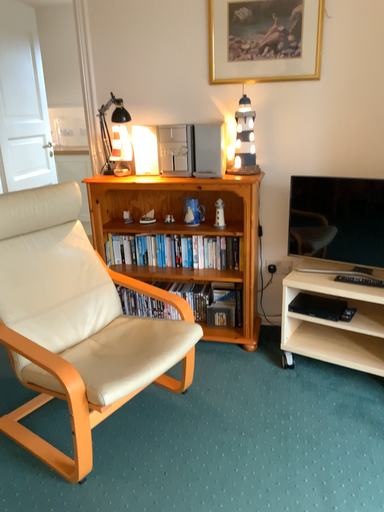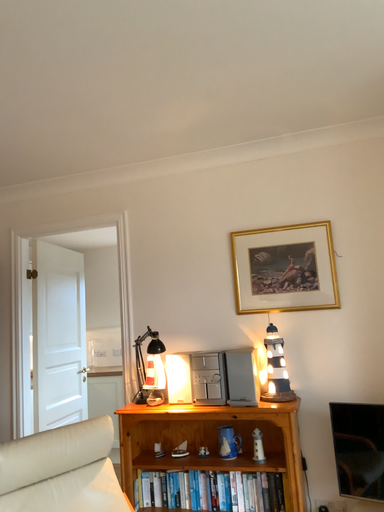
Question: Which way did the camera rotate in the video?

Choices:
 (A) rotated upward
 (B) rotated downward

Answer: (A)